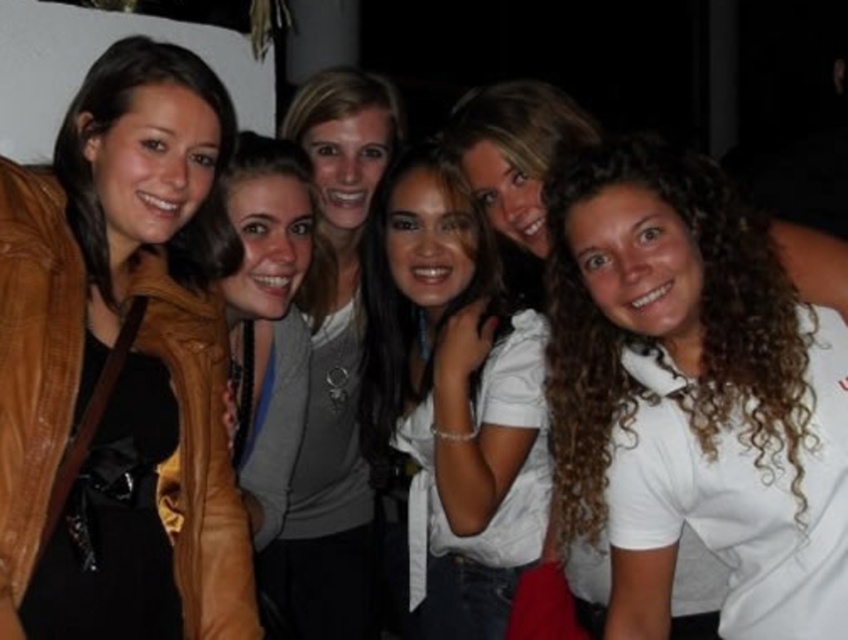
The height and width of the screenshot is (640, 848). What do you see at coordinates (455, 396) in the screenshot? I see `white matte shirt at center` at bounding box center [455, 396].

Does point (476, 476) lie in front of point (307, 509)?

Yes.

Between point (453, 468) and point (280, 468), which one is positioned behind?

The point (280, 468) is more distant.

You are a GUI agent. You are given a task and a screenshot of the screen. Output one action in this format:
    pyautogui.click(x=<x>, y=<y>)
    Task: Click on the white matte shirt at center
    
    Given the screenshot: What is the action you would take?
    pyautogui.click(x=455, y=396)

Is point (32, 336) closer to camera compared to point (745, 433)?

Yes, point (32, 336) is closer to viewer.

Is point (159, 432) behind point (723, 387)?

Yes, point (159, 432) is behind point (723, 387).

Looking at this image, who is more forward, (49, 556) or (768, 550)?

Point (49, 556) is in front.

Where is `brown leather jacket at left`? brown leather jacket at left is located at coordinates (120, 364).

What do you see at coordinates (120, 364) in the screenshot?
I see `brown leather jacket at left` at bounding box center [120, 364].

Which of these two, brown leather jacket at left or white matte shirt at center, stands taller?

white matte shirt at center is taller.

Between point (56, 554) and point (403, 436), which one is positioned in front?

Point (56, 554)

I want to click on brown leather jacket at left, so click(x=120, y=364).